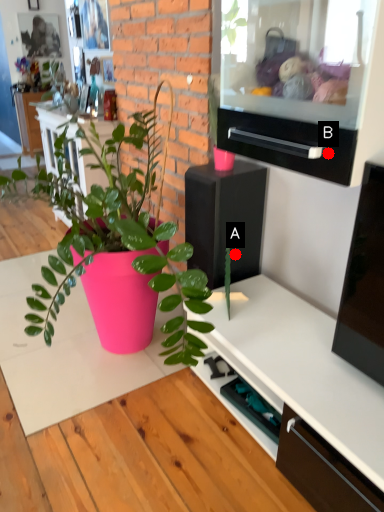
Question: Two points are circled on the image, labeled by A and B beside each circle. Which of the following is the closest to the observer?

Choices:
 (A) A is closer
 (B) B is closer

Answer: (B)